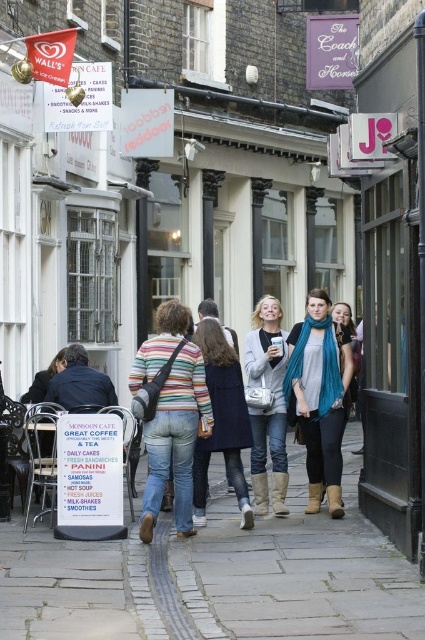
Question: Which point is closer to the camera?

Choices:
 (A) (271, 458)
 (B) (164, 349)
 (C) (34, 548)

Answer: (C)

Question: Does gray stone pavement at center have a lesser width compared to striped fabric sweater at center?

Choices:
 (A) yes
 (B) no

Answer: (A)

Question: Can you confirm if striped cotton sweater at center is positioned to the right of teal scarf at center?

Choices:
 (A) no
 (B) yes

Answer: (A)

Question: Which point is closer to the camera?

Choices:
 (A) striped fabric sweater at center
 (B) teal scarf at center

Answer: (A)

Question: Is teal scarf at center thinner than striped fabric sweater at center?

Choices:
 (A) yes
 (B) no

Answer: (B)

Question: Estimate the real-world distances between objects in this image. Which object is farther from the teal scarf at center?

Choices:
 (A) striped cotton sweater at center
 (B) gray stone pavement at center

Answer: (B)